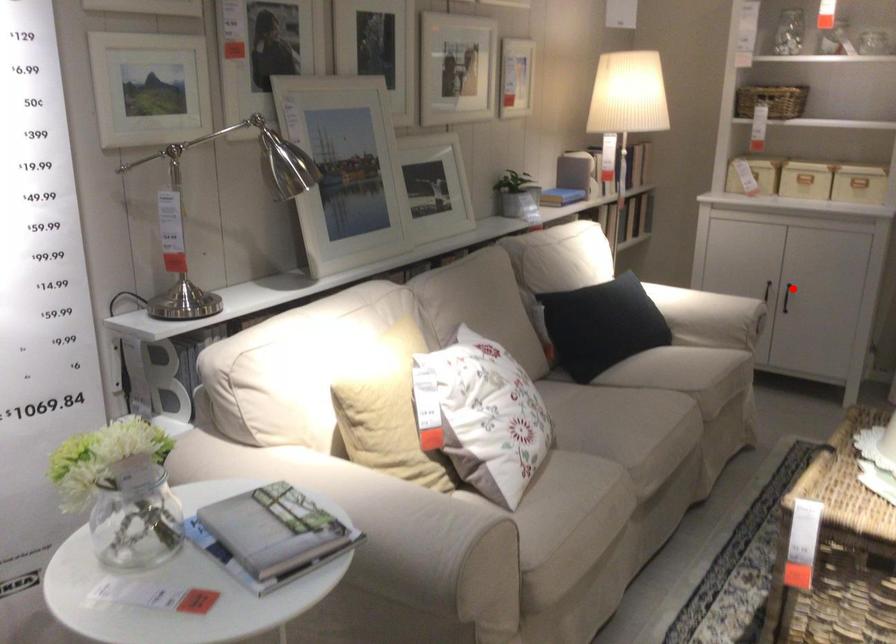
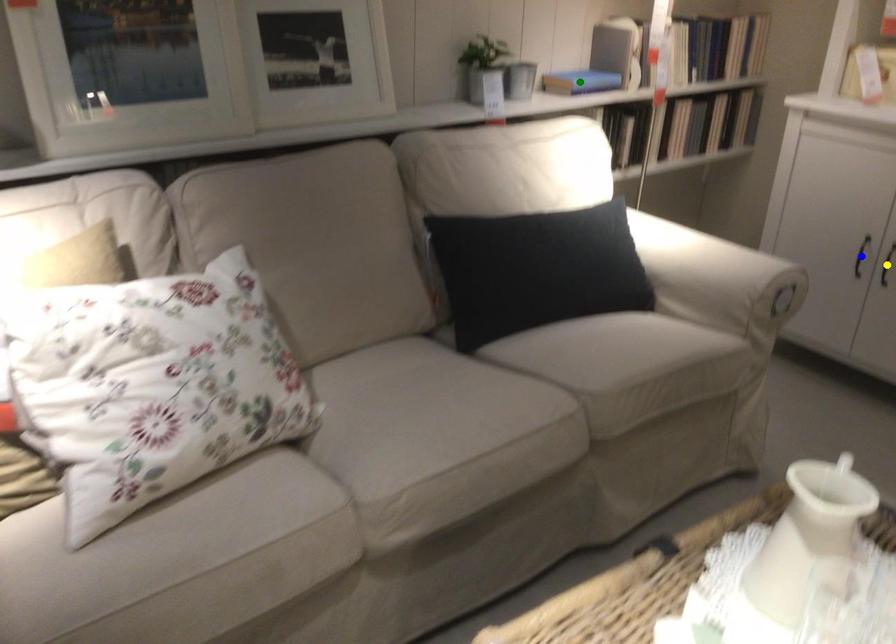
Question: I am providing you with two images of the same scene from different viewpoints. A red point is marked on the first image. You are given multiple points on the second image. Which spot in image 2 lines up with the point in image 1?

Choices:
 (A) yellow point
 (B) blue point
 (C) green point

Answer: (A)